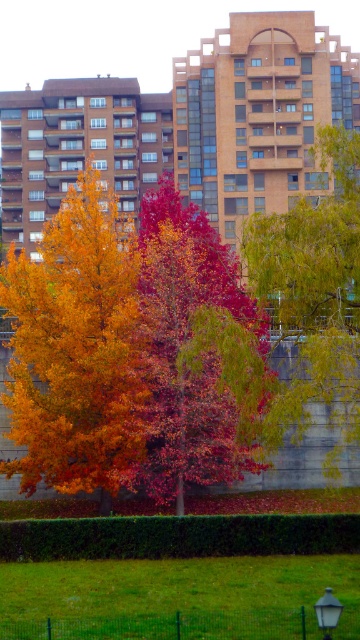
Is point (198, 294) positioned after point (335, 246)?

Yes, it is behind point (335, 246).

Describe the element at coordinates (123, 349) in the screenshot. This screenshot has height=640, width=360. I see `autumn leaves at center` at that location.

Find the location of a particular element. This screenshot has height=640, width=360. autumn leaves at center is located at coordinates (123, 349).